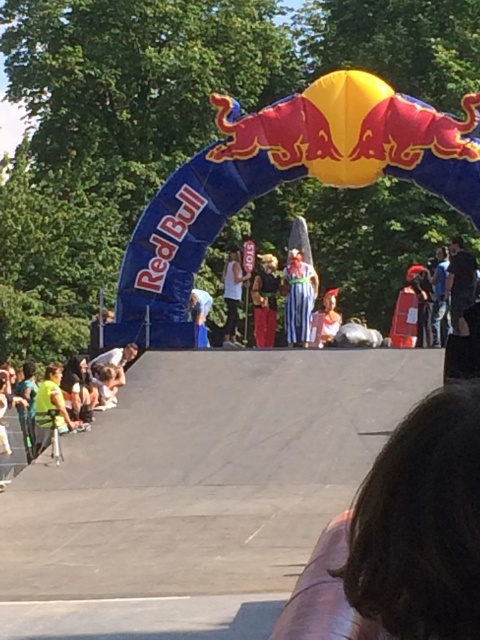
Question: In this image, where is yellow-green shirt at lower left located relative to black cotton shirt at right?

Choices:
 (A) above
 (B) below

Answer: (B)

Question: Is gray concrete skate park at center positioned in front of reddish-orange fabric pants at center?

Choices:
 (A) no
 (B) yes

Answer: (B)

Question: Which point is closer to the camera taking this photo?

Choices:
 (A) (230, 291)
 (B) (450, 243)
 (C) (137, 586)
 (D) (458, 484)

Answer: (D)

Question: From the image, what is the correct spatial relationship of brown hair at lower right in relation to reddish-orange fabric pants at center?

Choices:
 (A) above
 (B) below

Answer: (B)

Question: Estimate the real-world distances between objects in this image. Which object is closer to the white matte tank top at center?

Choices:
 (A) black cotton shirt at right
 (B) brown hair at lower right

Answer: (A)

Question: Which point is closer to the camera taking this photo?

Choices:
 (A) (314, 467)
 (B) (228, 282)

Answer: (A)